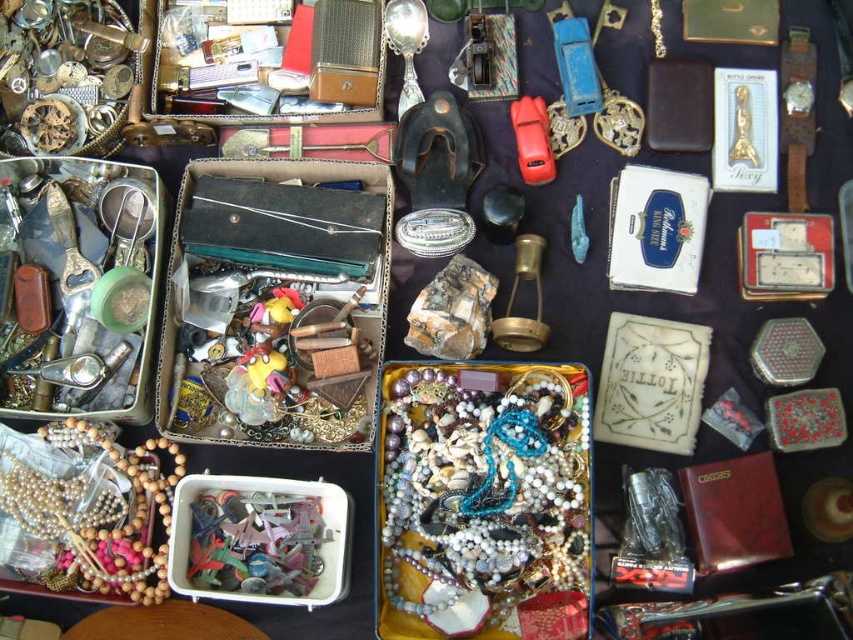
Question: Is gold-toned watch parts at upper left to the right of gold metallic bracelet at upper center from the viewer's perspective?

Choices:
 (A) no
 (B) yes

Answer: (A)

Question: Which of the following is the farthest from the observer?

Choices:
 (A) gold leather watch at upper right
 (B) gold metallic bracelet at upper center

Answer: (B)

Question: Observing the image, what is the correct spatial positioning of pearl-like beads at center in reference to gold metallic keychain at upper right?

Choices:
 (A) below
 (B) above

Answer: (A)

Question: Where is pearl-like beads at center located in relation to gold metallic keychain at upper right in the image?

Choices:
 (A) right
 (B) left

Answer: (B)

Question: Which object is positioned farthest from the gold metallic bracelet at upper center?

Choices:
 (A) wooden beads at lower left
 (B) silver shiny spoon at upper center
 (C) gold metallic lantern at center

Answer: (A)

Question: Considering the real-world distances, which object is farthest from the gold metallic lantern at center?

Choices:
 (A) gold metallic keychain at upper right
 (B) gold leather watch at upper right
 (C) gold-toned watch parts at upper left
 (D) pearl-like beads at center

Answer: (C)